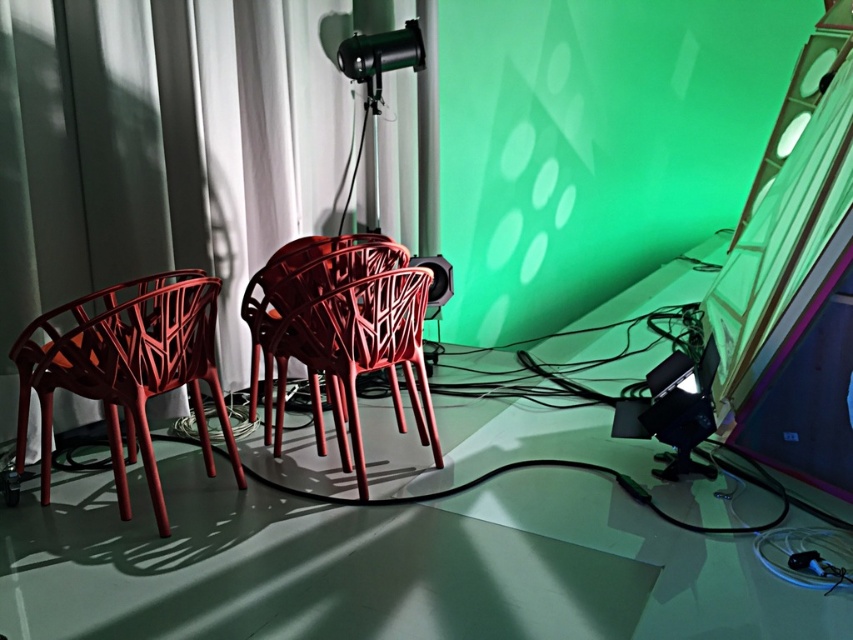
You are setting up a photo shoot in the studio and need to place two matte plastic chairs. The matte plastic chair at left and the matte plastic chair at center are both in the way of the camera. Which chair should you move first to ensure the camera has an unobstructed view?

You should move the matte plastic chair at left first because it is positioned under the matte plastic chair at center, meaning it is closer to the camera and blocking the view more directly.

You are setting up a photo shoot in the studio and need to position two matte plastic chairs so that one is to the left of the other. Given the current arrangement of the matte plastic chair at left and the matte plastic chair at center, which chair should you place on the right side to maintain proper positioning?

The matte plastic chair at center should be placed on the right side because the matte plastic chair at left is already positioned to its left.